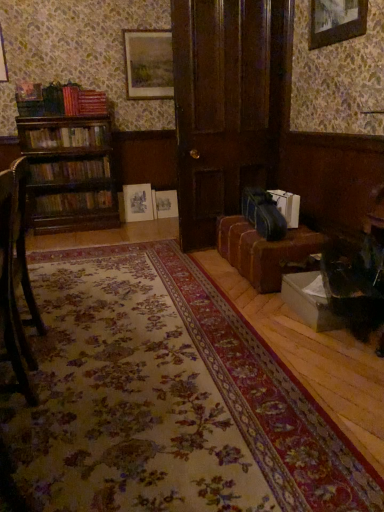
Question: Is hardcover books at left, arranged as the second book when viewed from the front, facing away from floral carpet at center?

Choices:
 (A) yes
 (B) no

Answer: (B)

Question: Can you confirm if hardcover books at left, which is the fourth book from bottom to top, is bigger than floral carpet at center?

Choices:
 (A) yes
 (B) no

Answer: (B)

Question: Can you confirm if hardcover books at left, arranged as the second book when viewed from the front, is thinner than floral carpet at center?

Choices:
 (A) yes
 (B) no

Answer: (A)

Question: Is hardcover books at left, which is the 3th book in back-to-front order, shorter than floral carpet at center?

Choices:
 (A) no
 (B) yes

Answer: (A)

Question: Is hardcover books at left, arranged as the 4th book when viewed from the right, located outside floral carpet at center?

Choices:
 (A) no
 (B) yes

Answer: (B)

Question: Is hardcover books at left, arranged as the second book when viewed from the front, touching floral carpet at center?

Choices:
 (A) yes
 (B) no

Answer: (B)

Question: Can you confirm if dark blue fabric suitcase at lower right is shorter than wooden chair at left?

Choices:
 (A) no
 (B) yes

Answer: (B)

Question: Does dark blue fabric suitcase at lower right have a lesser width compared to wooden chair at left?

Choices:
 (A) no
 (B) yes

Answer: (B)

Question: From the image's perspective, is dark blue fabric suitcase at lower right below wooden chair at left?

Choices:
 (A) yes
 (B) no

Answer: (B)

Question: From the image's perspective, is dark blue fabric suitcase at lower right on wooden chair at left?

Choices:
 (A) yes
 (B) no

Answer: (A)

Question: Could you tell me if dark blue fabric suitcase at lower right is facing wooden chair at left?

Choices:
 (A) no
 (B) yes

Answer: (B)

Question: Is dark blue fabric suitcase at lower right positioned behind wooden chair at left?

Choices:
 (A) no
 (B) yes

Answer: (B)

Question: Is dark wood door at center not inside white paper bag at lower right, which ranks as the 1th book in right-to-left order?

Choices:
 (A) yes
 (B) no

Answer: (A)